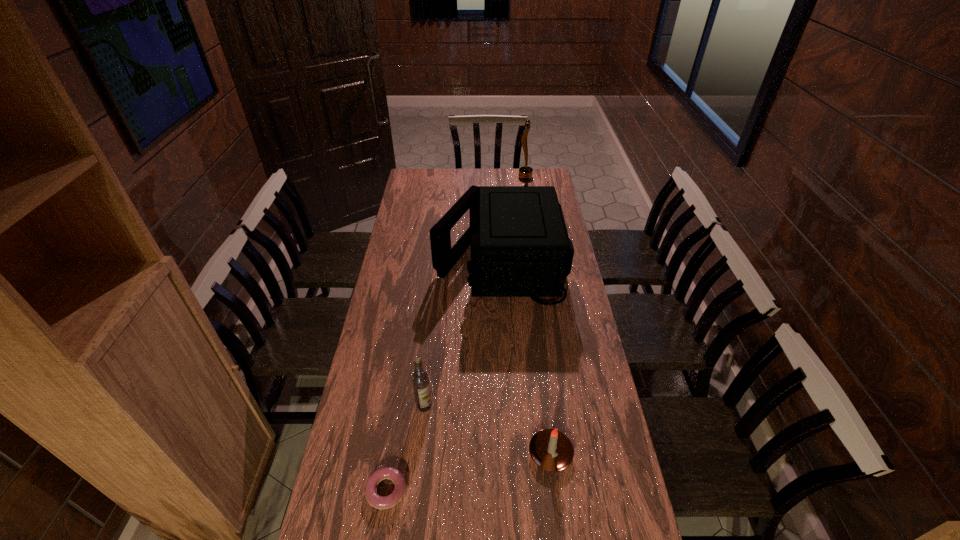
At what (x,y) coordinates should I click in order to perform the action: click on the farthest object. Please return your answer as a coordinate pair (x, y). Image resolution: width=960 pixels, height=540 pixels. Looking at the image, I should click on (525, 173).

You are a GUI agent. You are given a task and a screenshot of the screen. Output one action in this format:
    pyautogui.click(x=<x>, y=<y>)
    Task: Click on the award
    
    Given the screenshot: What is the action you would take?
    pyautogui.click(x=525, y=173)

You are a GUI agent. You are given a task and a screenshot of the screen. Output one action in this format:
    pyautogui.click(x=<x>, y=<y>)
    Task: Click on the second farthest object
    Image resolution: width=960 pixels, height=540 pixels.
    Given the screenshot: What is the action you would take?
    pyautogui.click(x=520, y=247)

Where is `the third nearest object`? The image size is (960, 540). the third nearest object is located at coordinates (420, 380).

I want to click on the third tallest object, so click(420, 380).

Where is `candle`? The image size is (960, 540). candle is located at coordinates (550, 449).

I want to click on doughnut, so click(x=379, y=502).

The image size is (960, 540). Identify the location of vacant area situated on the front-facing side of the farthest object. (465, 177).

The image size is (960, 540). I want to click on free location located 0.400m on the front-facing side of the farthest object, so click(444, 177).

Find the location of `vacant point located 0.300m on the front-facing side of the farthest object`. vacant point located 0.300m on the front-facing side of the farthest object is located at coordinates (463, 177).